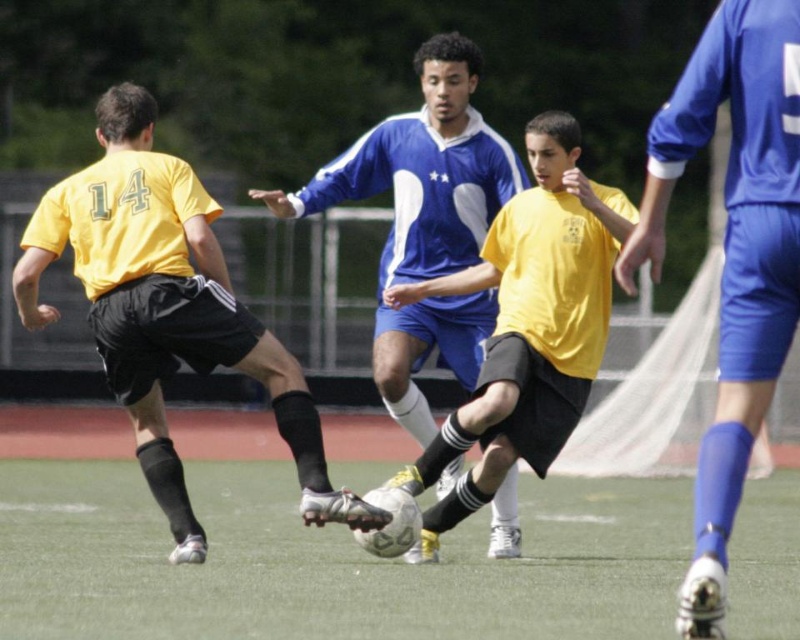
Between point (732, 554) and point (90, 244), which one is positioned in front?

Point (90, 244) is more forward.

Between green artificial turf at center and matte yellow jersey at left, which one is positioned higher?

Positioned higher is matte yellow jersey at left.

The height and width of the screenshot is (640, 800). I want to click on green artificial turf at center, so click(x=326, y=561).

Is blue smooth soccer uniform at right wider than blue matte soccer jersey at center?

In fact, blue smooth soccer uniform at right might be narrower than blue matte soccer jersey at center.

Who is positioned more to the right, blue smooth soccer uniform at right or blue matte soccer jersey at center?

blue smooth soccer uniform at right is more to the right.

At what (x,y) coordinates should I click in order to perform the action: click on blue smooth soccer uniform at right. Please return your answer as a coordinate pair (x, y). The height and width of the screenshot is (640, 800). Looking at the image, I should click on (732, 253).

Consider the image. Which of these two, green artificial turf at center or yellow matte shirt at center, stands shorter?

green artificial turf at center

Who is more forward, (88, 552) or (537, 342)?

Point (537, 342) is more forward.

This screenshot has width=800, height=640. Identify the location of green artificial turf at center. (326, 561).